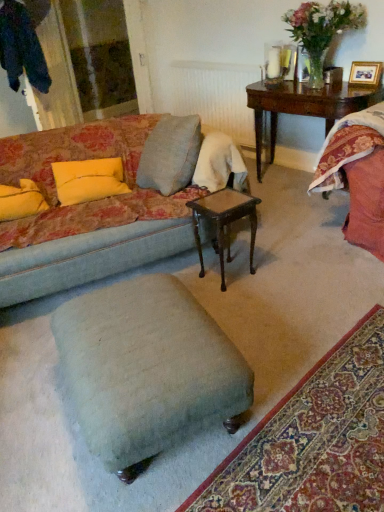
The width and height of the screenshot is (384, 512). What are the coordinates of `blank space above velvet teal ottoman at lower center (from a real-world perspective)` in the screenshot? It's located at (328, 433).